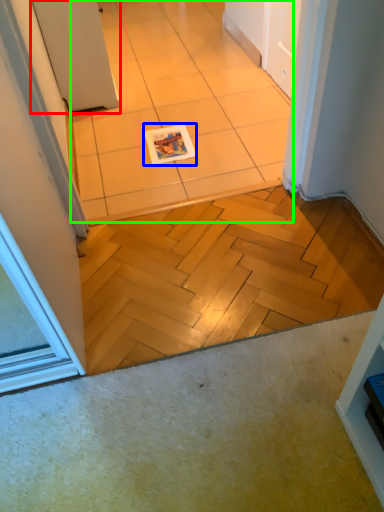
Question: Considering the real-world distances, which object is closest to door (highlighted by a red box)? magazine (highlighted by a blue box) or ceramic tile (highlighted by a green box).

Choices:
 (A) magazine
 (B) ceramic tile

Answer: (B)